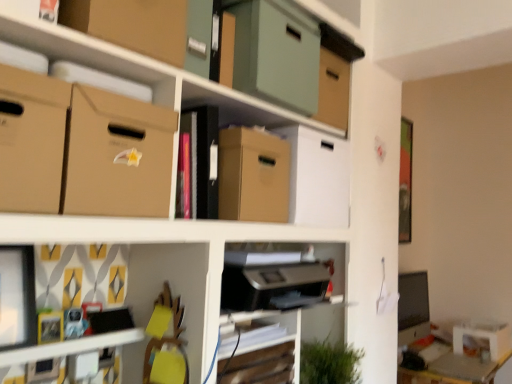
Question: Considering the positions of brown cardboard box at center, which is counted as the 5th cardboard box, starting from the top, and wooden swivel chair at lower center in the image, is brown cardboard box at center, which is counted as the 5th cardboard box, starting from the top, wider or thinner than wooden swivel chair at lower center?

Choices:
 (A) thin
 (B) wide

Answer: (B)

Question: From a real-world perspective, is brown cardboard box at center, which is counted as the 5th cardboard box, starting from the top, physically located above or below wooden swivel chair at lower center?

Choices:
 (A) below
 (B) above

Answer: (B)

Question: Estimate the real-world distances between objects in this image. Which object is farther from the wooden swivel chair at lower center?

Choices:
 (A) brown cardboard box at upper left, acting as the 2th cardboard box starting from the bottom
 (B) white cardboard box at lower right, arranged as the 1th storage box when viewed from the right
 (C) matte cardboard box at center, positioned as the second storage box in back-to-front order
 (D) matte cardboard boxes at upper center
 (E) matte plastic toy at lower left

Answer: (B)

Question: Which object is positioned farthest from the brown cardboard box at center, which is counted as the 5th cardboard box, starting from the top?

Choices:
 (A) matte plastic toy at lower left
 (B) matte cardboard boxes at upper center
 (C) white cardboard box at lower right, the second storage box viewed from the left
 (D) matte brown cardboard box at left, placed as the third cardboard box when sorted from bottom to top
 (E) brown cardboard box at upper left, acting as the 2th cardboard box starting from the bottom

Answer: (C)